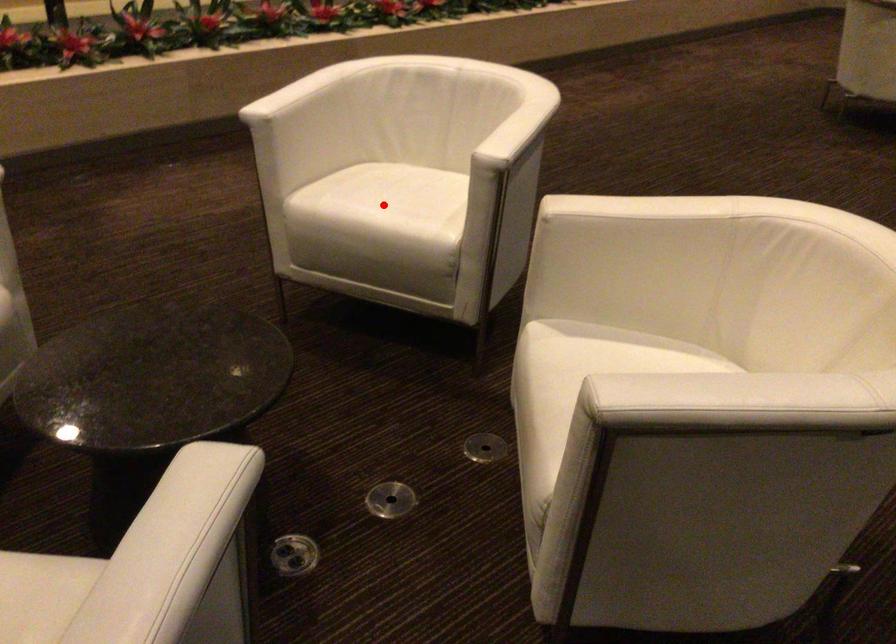
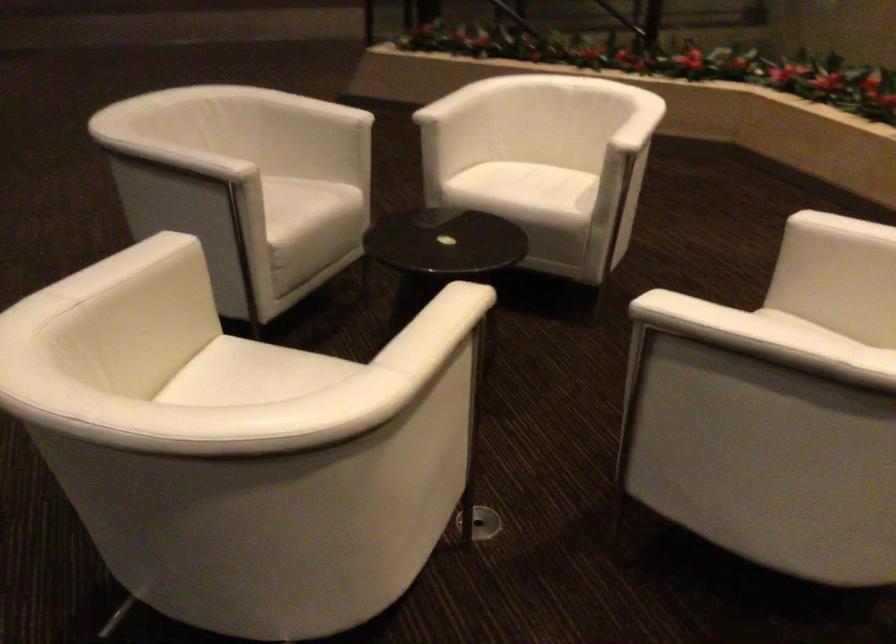
Question: I am providing you with two images of the same scene from different viewpoints. A red point is marked on the first image. Can you still see the location of the red point in image 2?

Choices:
 (A) Yes
 (B) No

Answer: (B)